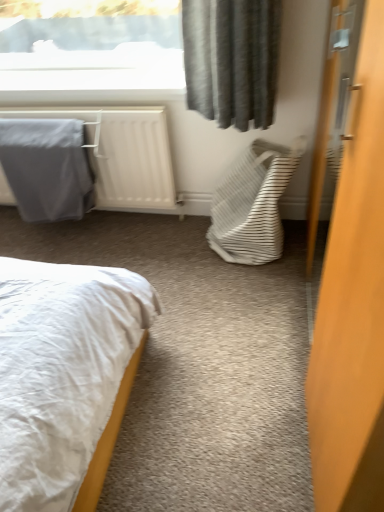
Where is `free point below wooden door at right (from a real-world perspective)`? The width and height of the screenshot is (384, 512). free point below wooden door at right (from a real-world perspective) is located at coordinates (298, 329).